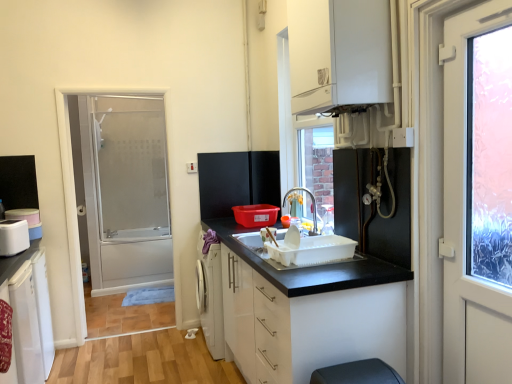
Question: From a real-world perspective, is white glossy cabinet at upper center, the first cabinetry viewed from the top, positioned under black matte refrigerator at center, marked as the second appliance in a front-to-back arrangement, based on gravity?

Choices:
 (A) yes
 (B) no

Answer: (B)

Question: Does white glossy cabinet at upper center, which is the third cabinetry from left to right, have a greater height compared to black matte refrigerator at center, the 1th appliance in the right-to-left sequence?

Choices:
 (A) yes
 (B) no

Answer: (A)

Question: Considering the relative sizes of white glossy cabinet at upper center, marked as the 3th cabinetry in a bottom-to-top arrangement, and black matte refrigerator at center, which appears as the first appliance when viewed from the back, in the image provided, is white glossy cabinet at upper center, marked as the 3th cabinetry in a bottom-to-top arrangement, shorter than black matte refrigerator at center, which appears as the first appliance when viewed from the back,?

Choices:
 (A) yes
 (B) no

Answer: (B)

Question: Would you say white glossy cabinet at upper center, which is the third cabinetry from left to right, is a long distance from black matte refrigerator at center, the 1th appliance in the right-to-left sequence?

Choices:
 (A) yes
 (B) no

Answer: (A)

Question: Does white glossy cabinet at upper center, marked as the 3th cabinetry in a bottom-to-top arrangement, have a greater width compared to black matte refrigerator at center, arranged as the second appliance when viewed from the left?

Choices:
 (A) no
 (B) yes

Answer: (B)

Question: In terms of size, does white matte door at right appear bigger or smaller than black matte refrigerator at center, which appears as the first appliance when viewed from the back?

Choices:
 (A) big
 (B) small

Answer: (A)

Question: In terms of width, does white matte door at right look wider or thinner when compared to black matte refrigerator at center, which appears as the 2th appliance when ordered from the bottom?

Choices:
 (A) wide
 (B) thin

Answer: (A)

Question: Based on their positions, is white matte door at right located to the left or right of black matte refrigerator at center, marked as the second appliance in a front-to-back arrangement?

Choices:
 (A) right
 (B) left

Answer: (A)

Question: Is white matte door at right taller or shorter than black matte refrigerator at center, which appears as the 2th appliance when ordered from the bottom?

Choices:
 (A) short
 (B) tall

Answer: (B)

Question: In the image, is white glossy cabinet at upper center, which is the third cabinetry from left to right, on the left side or the right side of white matte refrigerator at lower left, arranged as the third cabinetry when viewed from the right?

Choices:
 (A) right
 (B) left

Answer: (A)

Question: Would you say white glossy cabinet at upper center, the first cabinetry viewed from the top, is inside or outside white matte refrigerator at lower left, which ranks as the 3th cabinetry in top-to-bottom order?

Choices:
 (A) outside
 (B) inside

Answer: (A)

Question: From a real-world perspective, is white glossy cabinet at upper center, which is the third cabinetry from left to right, above or below white matte refrigerator at lower left, which is counted as the 1th cabinetry, starting from the bottom?

Choices:
 (A) above
 (B) below

Answer: (A)

Question: Is white glossy cabinet at upper center, marked as the 3th cabinetry in a bottom-to-top arrangement, taller or shorter than white matte refrigerator at lower left, acting as the first cabinetry starting from the left?

Choices:
 (A) tall
 (B) short

Answer: (B)

Question: Looking at the image, does white matte refrigerator at lower left, arranged as the third cabinetry when viewed from the right, seem bigger or smaller compared to white matte door at right?

Choices:
 (A) big
 (B) small

Answer: (A)

Question: Is white matte refrigerator at lower left, which is counted as the 1th cabinetry, starting from the bottom, in front of or behind white matte door at right in the image?

Choices:
 (A) front
 (B) behind

Answer: (B)